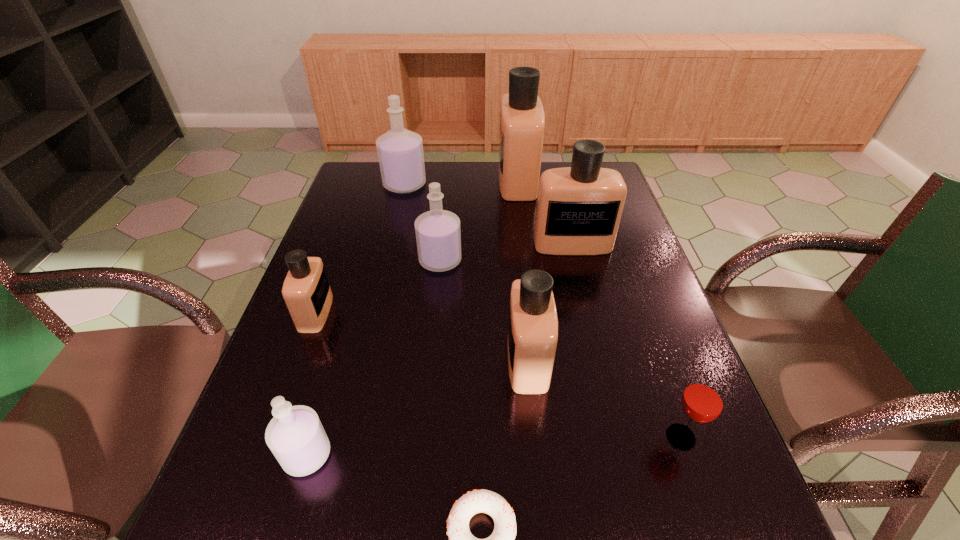
Where is `vacant space located on the front label of the third biggest beige perfume`? This screenshot has height=540, width=960. vacant space located on the front label of the third biggest beige perfume is located at coordinates (324, 360).

The image size is (960, 540). Identify the location of vacant region located 0.270m on the right of the nearest perfume. click(x=477, y=455).

The width and height of the screenshot is (960, 540). Find the location of `vacant point located on the front label of the leftmost object`. vacant point located on the front label of the leftmost object is located at coordinates (420, 313).

The width and height of the screenshot is (960, 540). Find the location of `vacant region located 0.280m on the back of the glass`. vacant region located 0.280m on the back of the glass is located at coordinates (637, 314).

The image size is (960, 540). What are the coordinates of `perfume at the right edge` in the screenshot? It's located at (579, 208).

Identify the location of glass that is positioned at the right edge. (703, 399).

Identify the location of object that is at the far left corner. (400, 153).

This screenshot has width=960, height=540. Identify the location of free space at the far edge. (471, 171).

Locate an element on the screen. This screenshot has width=960, height=540. free space at the near edge of the desktop is located at coordinates (363, 528).

Find the location of a particular element. The height and width of the screenshot is (540, 960). vacant space at the left edge of the desktop is located at coordinates (353, 315).